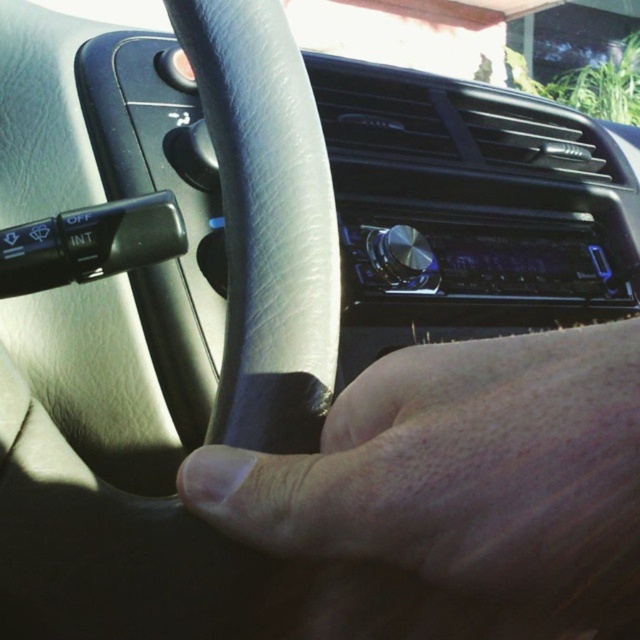
Can you confirm if leather at center is positioned above gray leather steering wheel at center?

No.

Does leather at center have a greater height compared to gray leather steering wheel at center?

Incorrect, leather at center's height is not larger of gray leather steering wheel at center's.

Find the location of `leather at center`. leather at center is located at coordinates (465, 474).